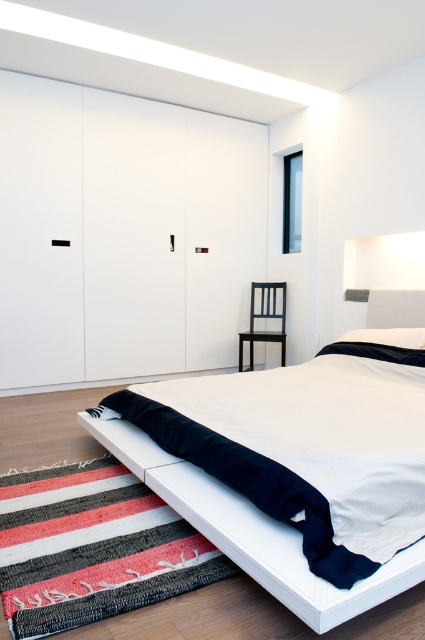
Question: Among these points, which one is nearest to the camera?

Choices:
 (A) (121, 438)
 (B) (419, 330)

Answer: (A)

Question: Can you confirm if black matte chair at right is wider than white soft pillow at lower right?

Choices:
 (A) yes
 (B) no

Answer: (B)

Question: Does white matte bed at center have a smaller size compared to white soft pillow at lower right?

Choices:
 (A) yes
 (B) no

Answer: (B)

Question: Among these points, which one is farthest from the camera?

Choices:
 (A) (195, 509)
 (B) (243, 339)

Answer: (B)

Question: Is white matte bed at center wider than white soft pillow at lower right?

Choices:
 (A) no
 (B) yes

Answer: (B)

Question: Among these points, which one is farthest from the camera?

Choices:
 (A) (246, 336)
 (B) (394, 566)

Answer: (A)